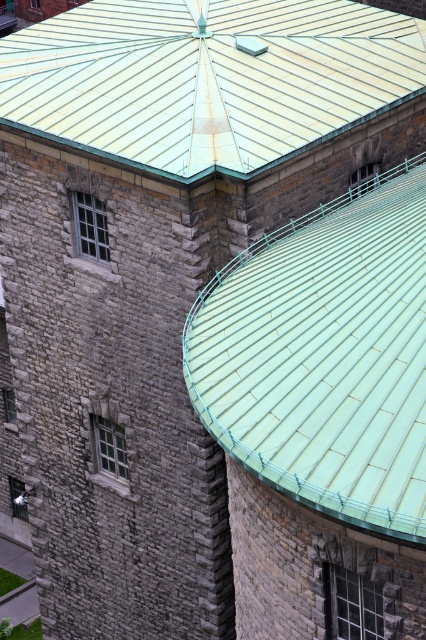
Where is `green metal tile roof at center`? The image size is (426, 640). green metal tile roof at center is located at coordinates (325, 355).

Between green metal tile roof at center and metallic green roof at upper center, which one appears on the left side from the viewer's perspective?

From the viewer's perspective, metallic green roof at upper center appears more on the left side.

The image size is (426, 640). I want to click on green metal tile roof at center, so click(325, 355).

The width and height of the screenshot is (426, 640). In order to click on green metal tile roof at center in this screenshot , I will do `click(325, 355)`.